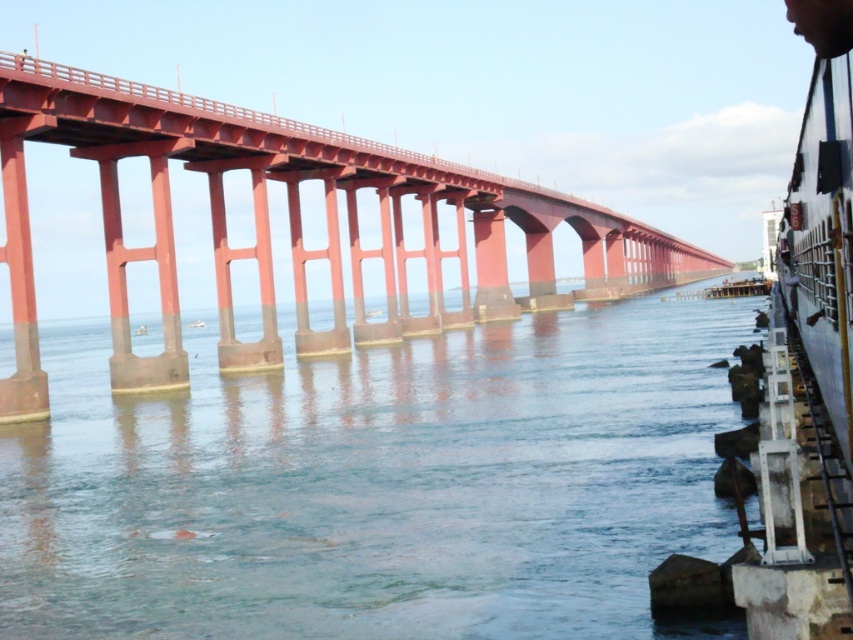
Can you confirm if clear water at center is taller than smooth red bridge at center?

No.

Between point (166, 401) and point (360, 307), which one is positioned behind?

Positioned behind is point (360, 307).

Identify the location of clear water at center. (378, 484).